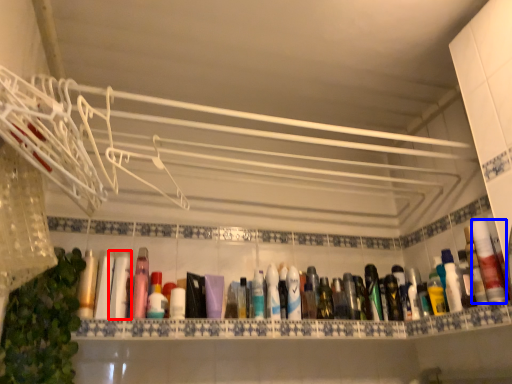
Question: Among these objects, which one is farthest to the camera, mouthwash (highlighted by a red box) or mouthwash (highlighted by a blue box)?

Choices:
 (A) mouthwash
 (B) mouthwash

Answer: (A)